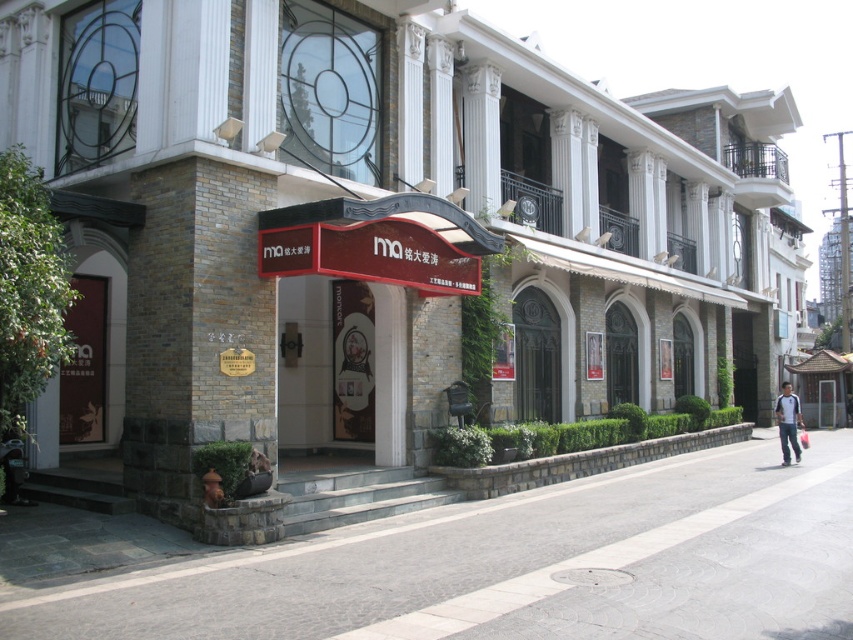
You are standing on the gray concrete pavement at lower center and want to walk to the blue jeans at lower right. Which direction should you move to reach them?

You should move to the right because the gray concrete pavement at lower center is to the left of the blue jeans at lower right.